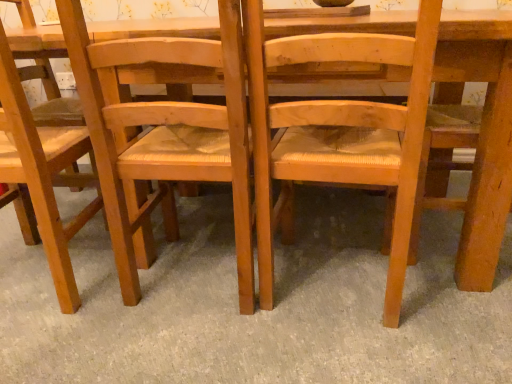
I want to click on vacant area situated below light brown wood chair at left, which ranks as the 1th chair in left-to-right order (from a real-world perspective), so click(x=47, y=270).